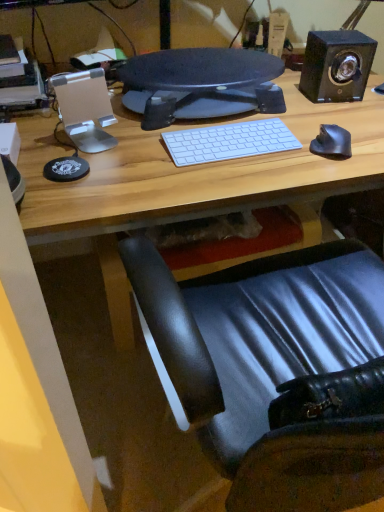
At what (x,y) coordinates should I click in order to perform the action: click on vacant region in front of matte black monitor at center. Please return your answer as a coordinate pair (x, y). The image size is (384, 512). Looking at the image, I should click on (181, 167).